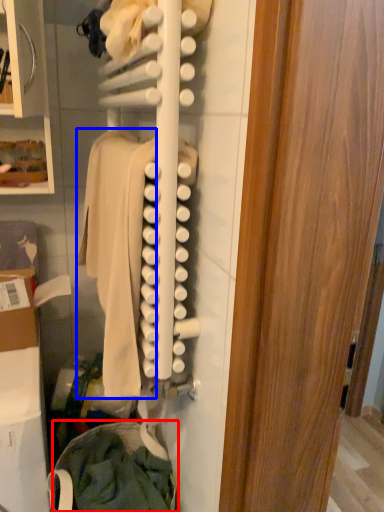
Question: Among these objects, which one is farthest to the camera, clothing (highlighted by a red box) or clothing (highlighted by a blue box)?

Choices:
 (A) clothing
 (B) clothing

Answer: (A)